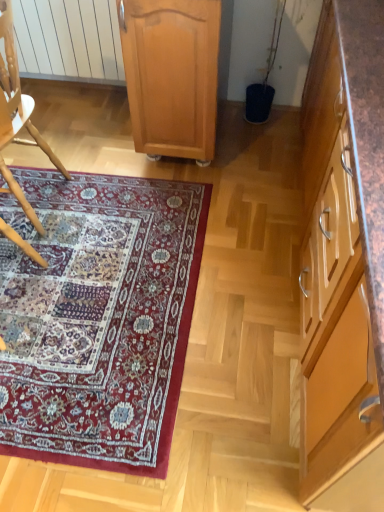
Locate an element on the screen. The image size is (384, 512). vacant space underneath carpet with intricate patterns at lower left (from a real-world perspective) is located at coordinates (97, 288).